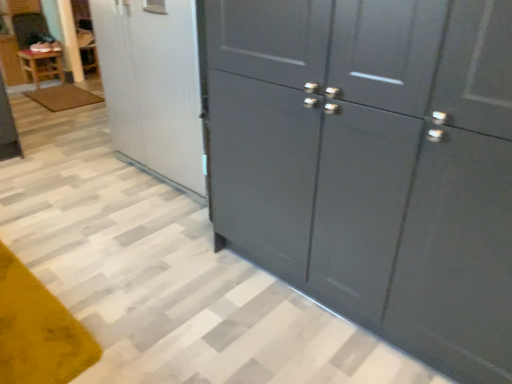
Question: From the image's perspective, is wooden table at left positioned above or below brown textured mat at lower left?

Choices:
 (A) below
 (B) above

Answer: (B)

Question: Is wooden table at left bigger or smaller than brown textured mat at lower left?

Choices:
 (A) big
 (B) small

Answer: (A)

Question: Based on their relative distances, which object is nearer to the glossy dark gray cupboard at right?

Choices:
 (A) wooden table at left
 (B) white glossy refrigerator at upper left
 (C) brown textured mat at lower left

Answer: (B)

Question: Estimate the real-world distances between objects in this image. Which object is farther from the white glossy refrigerator at upper left?

Choices:
 (A) brown textured mat at lower left
 (B) glossy dark gray cupboard at right
 (C) wooden table at left

Answer: (C)